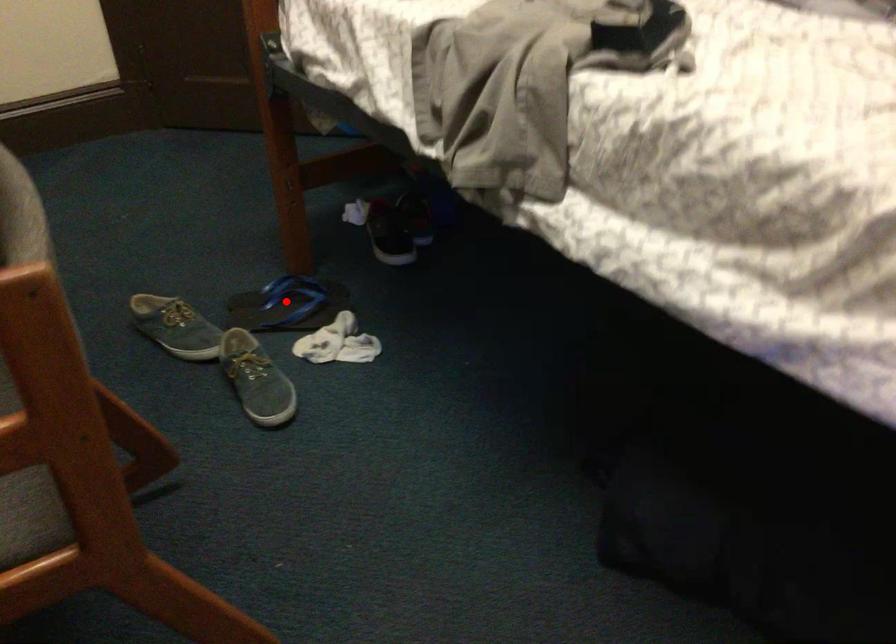
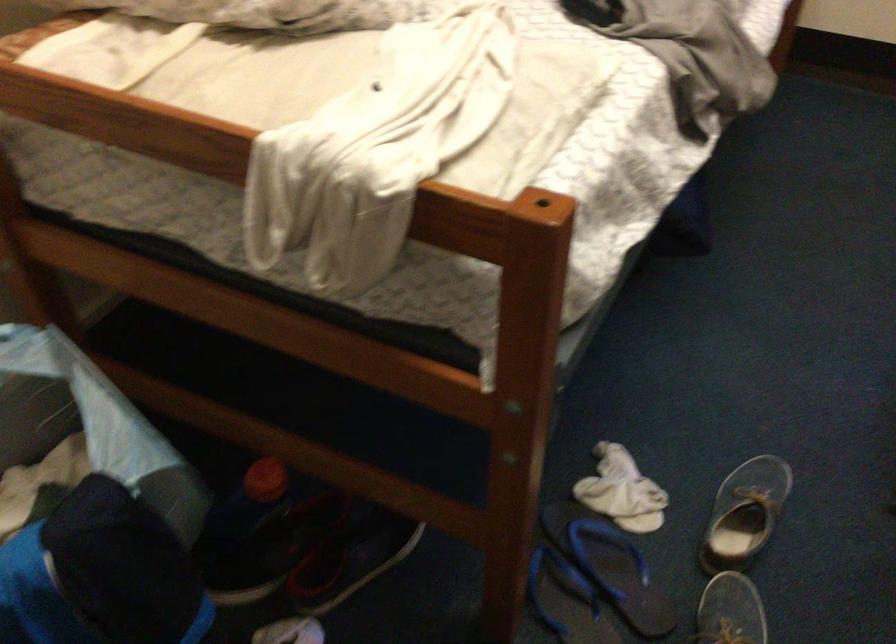
Find the pixel in the second image that matches the highlighted location in the first image.

(566, 600)